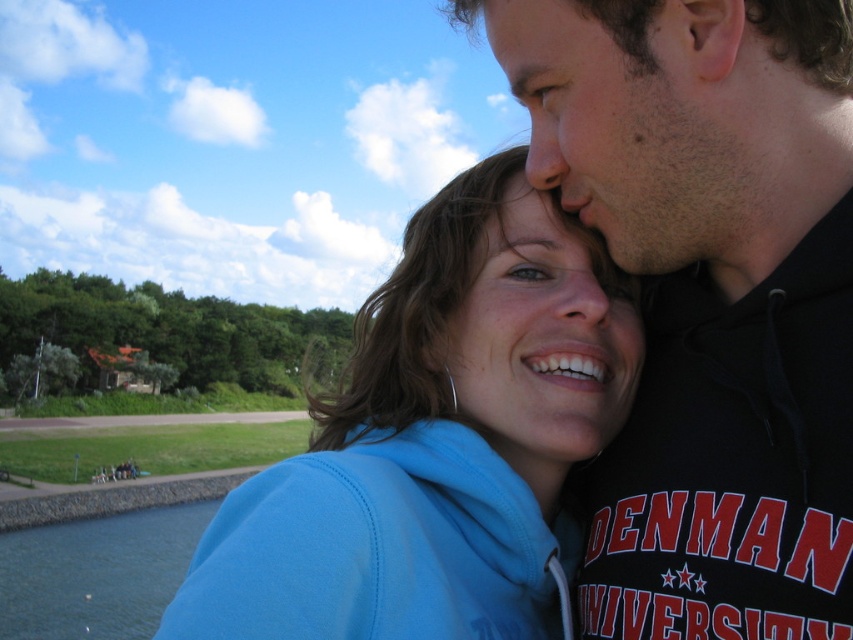
Between black matte hoodie at upper right and clear water at lower left, which one appears on the right side from the viewer's perspective?

From the viewer's perspective, black matte hoodie at upper right appears more on the right side.

Does black matte hoodie at upper right have a greater width compared to clear water at lower left?

Incorrect, black matte hoodie at upper right's width does not surpass clear water at lower left's.

What do you see at coordinates (709, 296) in the screenshot?
I see `black matte hoodie at upper right` at bounding box center [709, 296].

Locate an element on the screen. black matte hoodie at upper right is located at coordinates (709, 296).

Is black matte hoodie at upper right positioned behind blue fleece jacket at center?

Yes, black matte hoodie at upper right is further from the viewer.

How much distance is there between black matte hoodie at upper right and blue fleece jacket at center?

black matte hoodie at upper right and blue fleece jacket at center are 1.09 meters apart from each other.

This screenshot has width=853, height=640. Describe the element at coordinates (709, 296) in the screenshot. I see `black matte hoodie at upper right` at that location.

The image size is (853, 640). Find the location of `black matte hoodie at upper right`. black matte hoodie at upper right is located at coordinates (709, 296).

Who is taller, blue fleece jacket at center or clear water at lower left?

blue fleece jacket at center is taller.

Does point (374, 637) lie behind point (138, 520)?

No, it is in front of (138, 520).

Describe the element at coordinates (434, 440) in the screenshot. The image size is (853, 640). I see `blue fleece jacket at center` at that location.

Locate an element on the screen. The height and width of the screenshot is (640, 853). blue fleece jacket at center is located at coordinates (434, 440).